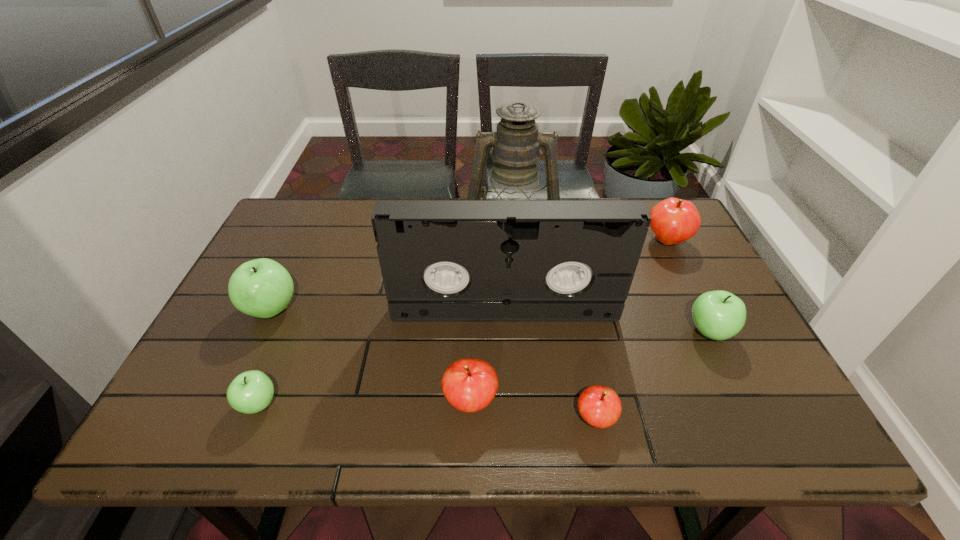
At what (x,y) coordinates should I click in order to perform the action: click on oil lamp at the far edge. Please return your answer as a coordinate pair (x, y). The width and height of the screenshot is (960, 540). Looking at the image, I should click on (516, 145).

This screenshot has height=540, width=960. I want to click on apple located at the far edge, so click(673, 221).

Where is `object present at the near left corner`? The height and width of the screenshot is (540, 960). object present at the near left corner is located at coordinates (250, 392).

The image size is (960, 540). I want to click on object situated at the far right corner, so click(673, 221).

The height and width of the screenshot is (540, 960). In order to click on vacant area at the far edge in this screenshot , I will do `click(344, 207)`.

The image size is (960, 540). I want to click on vacant region at the near edge of the desktop, so click(288, 416).

Identify the location of blank space at the left edge of the desktop. (273, 333).

In the image, there is a desktop. Where is `vacant space at the right edge`? vacant space at the right edge is located at coordinates (706, 285).

In order to click on vacant region at the far left corner of the desktop in this screenshot , I will do `click(324, 220)`.

In the image, there is a desktop. Identify the location of blank space at the far right corner. (638, 198).